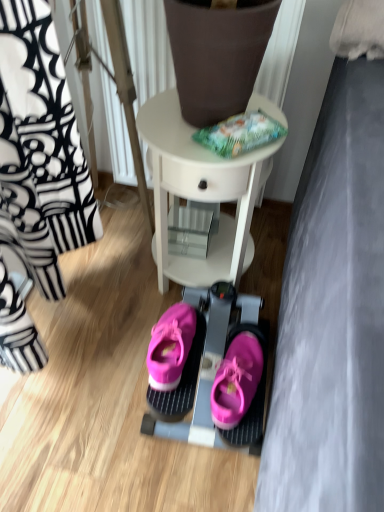
Where is `free space to the left of white glossy table at center`? The image size is (384, 512). free space to the left of white glossy table at center is located at coordinates (104, 284).